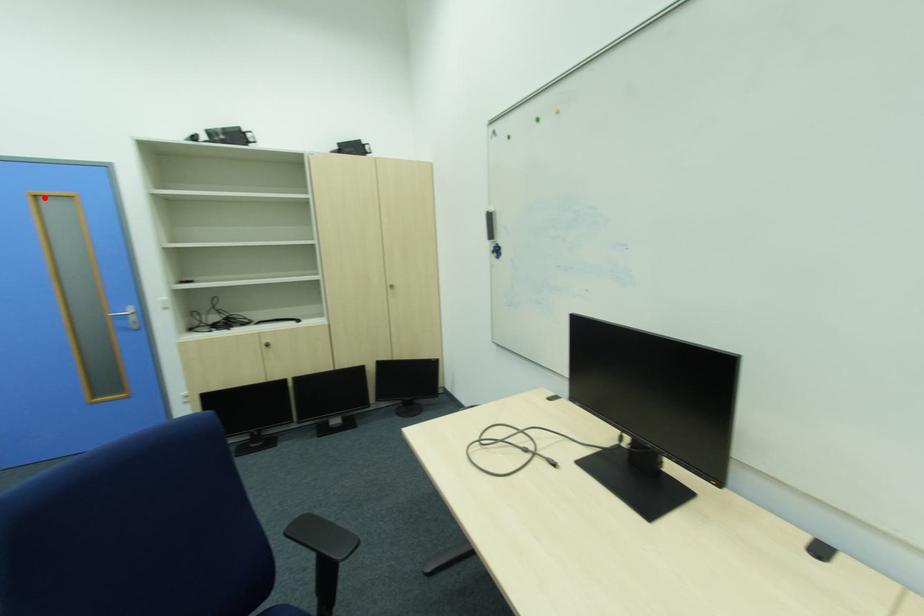
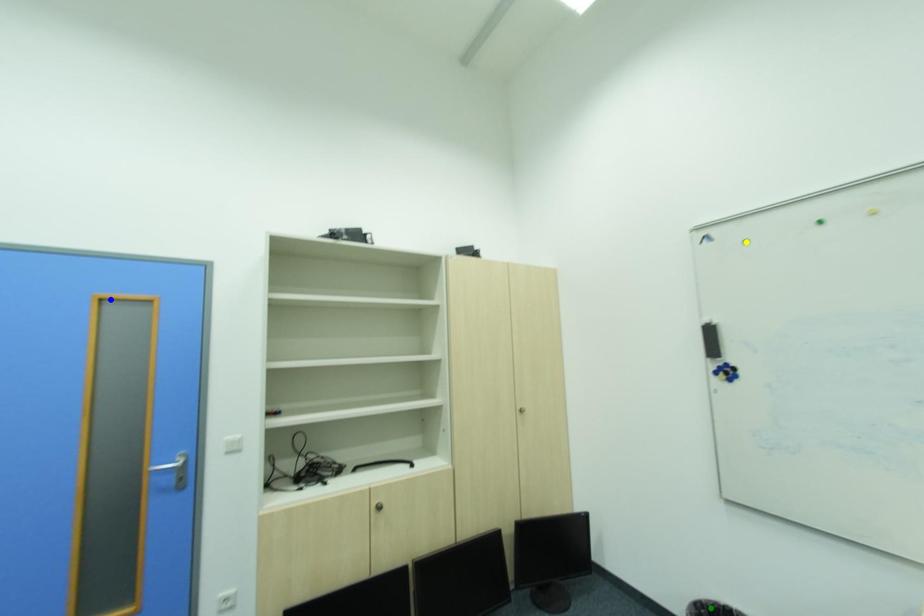
Question: I am providing you with two images of the same scene from different viewpoints. A red point is marked on the first image. You are given multiple points on the second image. Which spot in image 2 lines up with the point in image 1?

Choices:
 (A) green point
 (B) yellow point
 (C) blue point

Answer: (C)